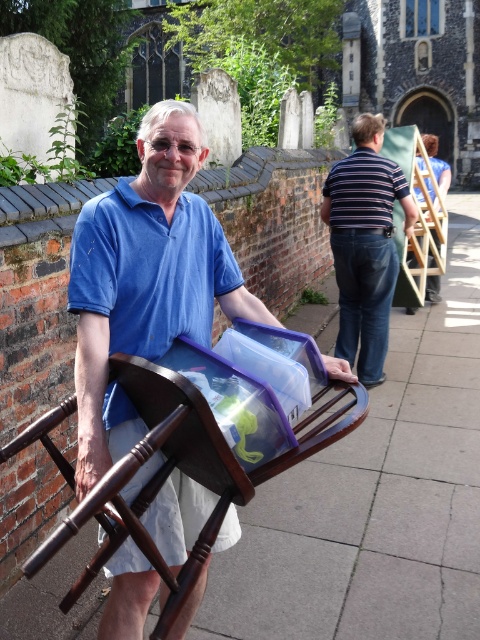
This screenshot has height=640, width=480. What do you see at coordinates (145, 280) in the screenshot?
I see `matte blue shirt at center` at bounding box center [145, 280].

Image resolution: width=480 pixels, height=640 pixels. What are the coordinates of `matte blue shirt at center` in the screenshot? It's located at click(x=145, y=280).